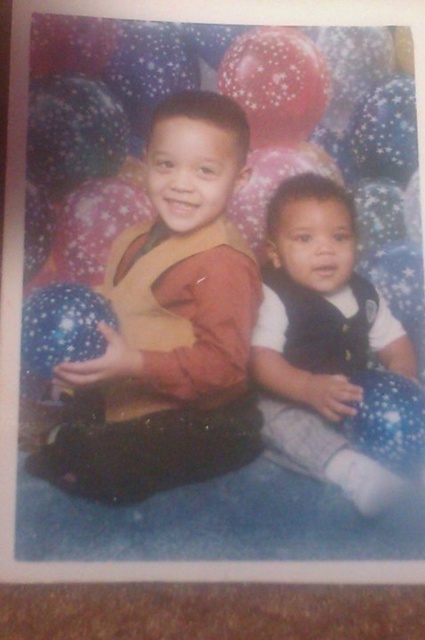
You are a photographer taking a picture of the two children. You need to place a matte yellow vest at center at the exact coordinates mentioned in the description. Where should you place it?

The matte yellow vest at center should be placed at the coordinates point (x=163, y=324) as specified in the description.

You are a photographer standing in front of the two children. You want to take a closeup shot of the matte yellow vest at center. Is the distance sufficient for your camera which requires a minimum of 20 inches to focus properly?

The matte yellow vest at center is 23.08 inches from viewer, which is more than the required 20 inches, so the distance is sufficient for the camera to focus properly.

You are a photographer setting up for a group photo. You notice two vests in the image, a matte yellow vest at center and a white soft vest at center. Which vest is positioned higher in the image?

The matte yellow vest at center is located above the white soft vest at center, so it is positioned higher in the image.